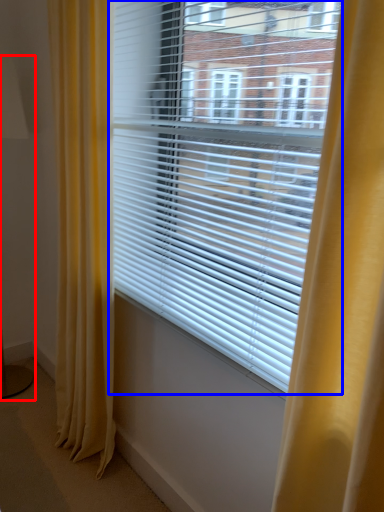
Question: Which of the following is the closest to the observer, table lamp (highlighted by a red box) or window blind (highlighted by a blue box)?

Choices:
 (A) table lamp
 (B) window blind

Answer: (B)